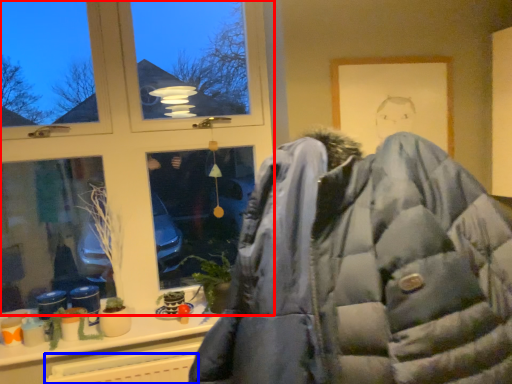
Question: Which object is further to the camera taking this photo, window (highlighted by a red box) or radiator (highlighted by a blue box)?

Choices:
 (A) window
 (B) radiator

Answer: (A)